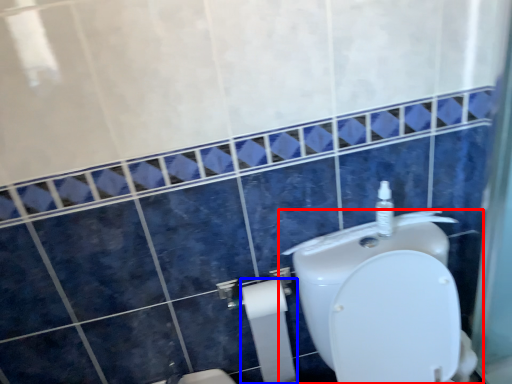
Question: Among these objects, which one is farthest to the camera, toilet (highlighted by a red box) or toilet paper (highlighted by a blue box)?

Choices:
 (A) toilet
 (B) toilet paper

Answer: (B)